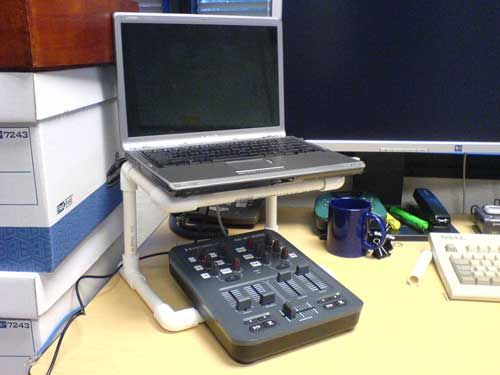
Find the location of a particular element. The width and height of the screenshot is (500, 375). trackpad is located at coordinates (249, 163).